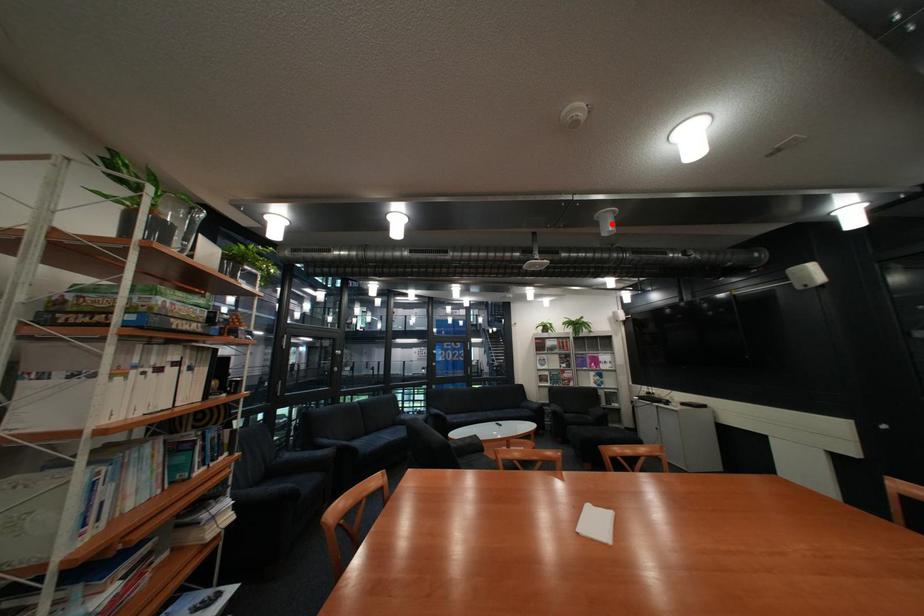
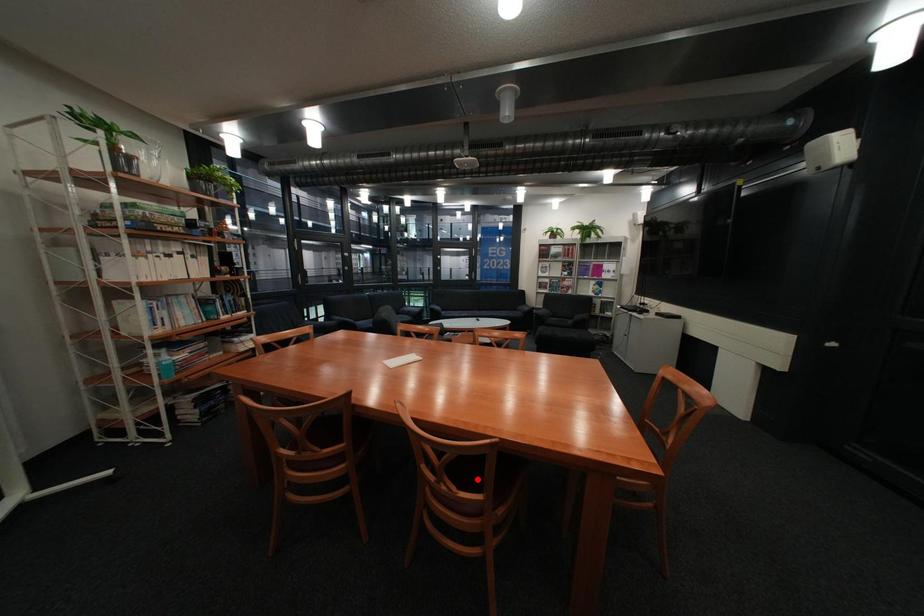
I am providing you with two images of the same scene from different viewpoints. A red point is marked on the first image and another point is marked on the second image. Do the highlighted points in image1 and image2 indicate the same real-world spot?

No